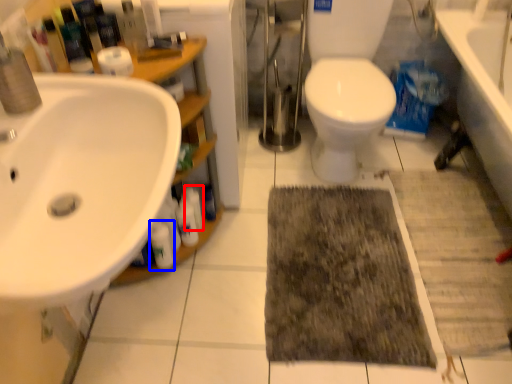
Question: Which point is further to the camera, toiletry (highlighted by a red box) or cleaning product (highlighted by a blue box)?

Choices:
 (A) toiletry
 (B) cleaning product

Answer: (A)